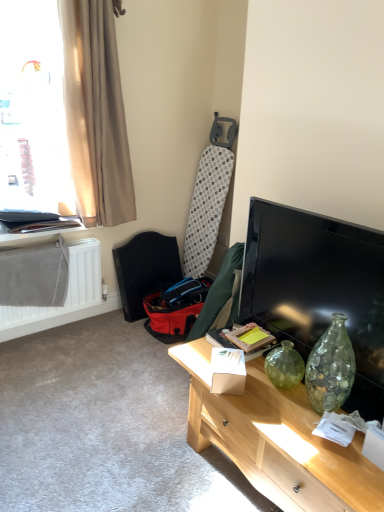
Measure the distance between red fabric swivel chair at lower left and camera.

red fabric swivel chair at lower left and camera are 2.88 meters apart.

Describe the element at coordinates (145, 269) in the screenshot. The height and width of the screenshot is (512, 384). I see `red fabric swivel chair at lower left` at that location.

The width and height of the screenshot is (384, 512). I want to click on translucent beige curtain at upper left, so point(33,110).

Image resolution: width=384 pixels, height=512 pixels. What do you see at coordinates (277, 440) in the screenshot?
I see `matte wooden desk at lower right` at bounding box center [277, 440].

Find the location of a particular element. The width and height of the screenshot is (384, 512). beige fabric curtain at upper left is located at coordinates (96, 113).

Which object is thinner, white matte radiator at lower left or red fabric swivel chair at lower left?

With smaller width is white matte radiator at lower left.

From the image's perspective, is white matte radiator at lower left above or below red fabric swivel chair at lower left?

Based on their image positions, white matte radiator at lower left is located beneath red fabric swivel chair at lower left.

From the picture: Would you say white matte radiator at lower left contains red fabric swivel chair at lower left?

Actually, red fabric swivel chair at lower left is outside white matte radiator at lower left.

Considering the sizes of objects matte black folder at upper left and matte black tv at right in the image provided, who is thinner, matte black folder at upper left or matte black tv at right?

matte black tv at right.

From a real-world perspective, is matte black folder at upper left positioned over matte black tv at right based on gravity?

No, from a real-world perspective, matte black folder at upper left is not on top of matte black tv at right.

Looking at this image, can you confirm if matte black folder at upper left is taller than matte black tv at right?

No.

Can you confirm if matte black folder at upper left is smaller than matte black tv at right?

Correct, matte black folder at upper left occupies less space than matte black tv at right.

Is white matte radiator at lower left facing away from matte black folder at upper left?

No, white matte radiator at lower left is not facing the opposite direction of matte black folder at upper left.

In terms of size, does white matte radiator at lower left appear bigger or smaller than matte black folder at upper left?

In the image, white matte radiator at lower left appears to be larger than matte black folder at upper left.

Which object is wider, white matte radiator at lower left or matte black folder at upper left?

matte black folder at upper left.

The height and width of the screenshot is (512, 384). Identify the location of radiator that is on the right side of matte black folder at upper left. (66, 295).

Does point (129, 261) come behind point (191, 422)?

Yes, point (129, 261) is farther from viewer.

Is red fabric swivel chair at lower left to the right of matte wooden desk at lower right from the viewer's perspective?

Result: No.

What are the coordinates of `desk in front of the red fabric swivel chair at lower left` in the screenshot? It's located at (277, 440).

Is red fabric swivel chair at lower left bigger than matte wooden desk at lower right?

Incorrect, red fabric swivel chair at lower left is not larger than matte wooden desk at lower right.

You are a GUI agent. You are given a task and a screenshot of the screen. Output one action in this format:
    pyautogui.click(x=<x>, y=<y>)
    Task: Click on the television above the white matte radiator at lower left (from a real-world perspective)
    This screenshot has height=512, width=384.
    Given the screenshot: What is the action you would take?
    pyautogui.click(x=318, y=288)

How different are the orientations of white matte radiator at lower left and matte black tv at right in degrees?

They differ by 86.8 degrees in their facing directions.

Would you consider white matte radiator at lower left to be distant from matte black tv at right?

Indeed, white matte radiator at lower left is not near matte black tv at right.

Which of these two, white matte radiator at lower left or matte black tv at right, is wider?

Wider between the two is white matte radiator at lower left.

Is translucent beige curtain at upper left far away from matte black folder at upper left?

No, there isn't a large distance between translucent beige curtain at upper left and matte black folder at upper left.

How many degrees apart are the facing directions of translucent beige curtain at upper left and matte black folder at upper left?

0.171 degrees separate the facing orientations of translucent beige curtain at upper left and matte black folder at upper left.

From a real-world perspective, who is located higher, translucent beige curtain at upper left or matte black folder at upper left?

translucent beige curtain at upper left is physically above.

Could you tell me if translucent beige curtain at upper left is turned towards matte black folder at upper left?

No, translucent beige curtain at upper left is not turned towards matte black folder at upper left.

From the image's perspective, between beige fabric curtain at upper left and red fabric swivel chair at lower left, who is located below?

From the image's view, red fabric swivel chair at lower left is below.

Which is behind, beige fabric curtain at upper left or red fabric swivel chair at lower left?

red fabric swivel chair at lower left.

Is beige fabric curtain at upper left touching red fabric swivel chair at lower left?

No, beige fabric curtain at upper left is not in contact with red fabric swivel chair at lower left.

Between beige fabric curtain at upper left and red fabric swivel chair at lower left, which one has less height?

Standing shorter between the two is red fabric swivel chair at lower left.

The image size is (384, 512). I want to click on swivel chair located underneath the white matte radiator at lower left (from a real-world perspective), so click(145, 269).

At what (x,y) coordinates should I click in order to perform the action: click on television below the matte black folder at upper left (from the image's perspective). Please return your answer as a coordinate pair (x, y). The width and height of the screenshot is (384, 512). Looking at the image, I should click on (318, 288).

From the image, which object appears to be farther from red fabric swivel chair at lower left, white matte radiator at lower left or matte black folder at upper left?

matte black folder at upper left.

Looking at the image, which one is located closer to white matte radiator at lower left, beige fabric curtain at upper left or matte black folder at upper left?

Among the two, matte black folder at upper left is located nearer to white matte radiator at lower left.

In the scene shown: Looking at the image, which one is located further to beige fabric curtain at upper left, white matte radiator at lower left or red fabric swivel chair at lower left?

Based on the image, red fabric swivel chair at lower left appears to be further to beige fabric curtain at upper left.

From the image, which object appears to be nearer to translucent beige curtain at upper left, red fabric swivel chair at lower left or matte black tv at right?

The object closer to translucent beige curtain at upper left is red fabric swivel chair at lower left.

From the image, which object appears to be farther from matte black tv at right, matte wooden desk at lower right or white matte radiator at lower left?

Answer: white matte radiator at lower left lies further to matte black tv at right than the other object.

Looking at the image, which one is located further to red fabric swivel chair at lower left, translucent beige curtain at upper left or matte black tv at right?

matte black tv at right.

When comparing their distances from white matte radiator at lower left, does beige fabric curtain at upper left or red fabric swivel chair at lower left seem further?

beige fabric curtain at upper left is further to white matte radiator at lower left.

Considering their positions, is translucent beige curtain at upper left positioned further to matte black folder at upper left than red fabric swivel chair at lower left?

red fabric swivel chair at lower left is positioned further to the anchor matte black folder at upper left.

This screenshot has width=384, height=512. I want to click on window sill that lies between beige fabric curtain at upper left and red fabric swivel chair at lower left from top to bottom, so click(x=39, y=232).

What are the coordinates of `curtain located between white matte radiator at lower left and matte black tv at right in the left-right direction` in the screenshot? It's located at (96, 113).

The width and height of the screenshot is (384, 512). I want to click on window sill between beige fabric curtain at upper left and matte wooden desk at lower right from top to bottom, so click(39, 232).

I want to click on window sill between matte wooden desk at lower right and red fabric swivel chair at lower left from front to back, so click(x=39, y=232).